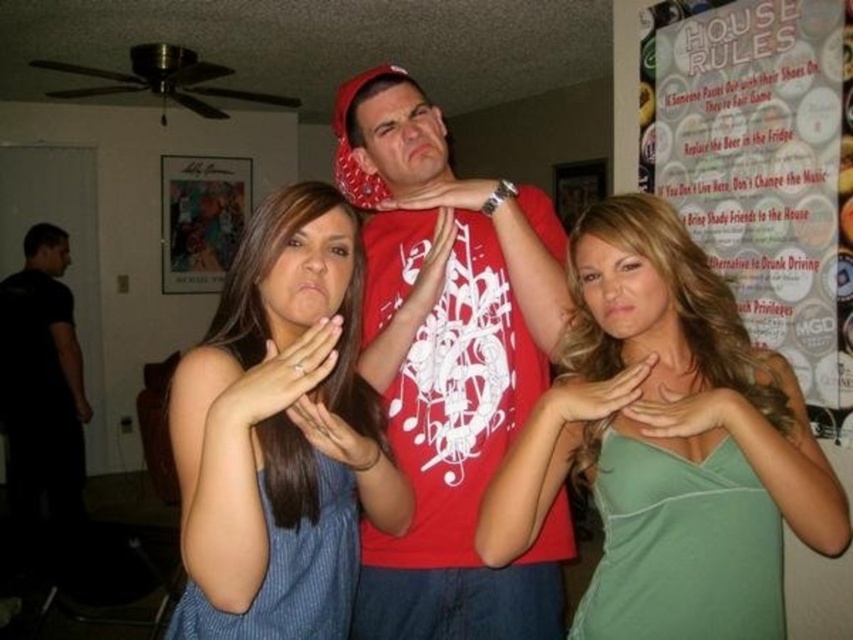
Question: Estimate the real-world distances between objects in this image. Which object is farther from the black matte shirt at left?

Choices:
 (A) green satin tank top at center
 (B) white paper poster at upper right
 (C) blue striped tank top at center

Answer: (B)

Question: Which object is farther from the camera taking this photo?

Choices:
 (A) green satin tank top at center
 (B) black matte shirt at left

Answer: (B)

Question: Can you confirm if matte red t-shirt at center is positioned below white paper poster at upper right?

Choices:
 (A) no
 (B) yes

Answer: (B)

Question: Which object is closer to the camera taking this photo?

Choices:
 (A) white paper poster at upper right
 (B) green satin tank top at center
 (C) blue striped tank top at center

Answer: (C)

Question: Is white paper poster at upper right above black matte shirt at left?

Choices:
 (A) no
 (B) yes

Answer: (B)

Question: Can you confirm if blue striped tank top at center is bigger than black matte shirt at left?

Choices:
 (A) no
 (B) yes

Answer: (A)